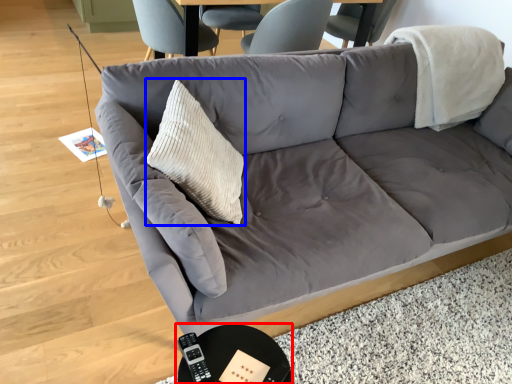
Question: Which object appears closest to the camera in this image, round table (highlighted by a red box) or throw pillow (highlighted by a blue box)?

Choices:
 (A) round table
 (B) throw pillow

Answer: (A)